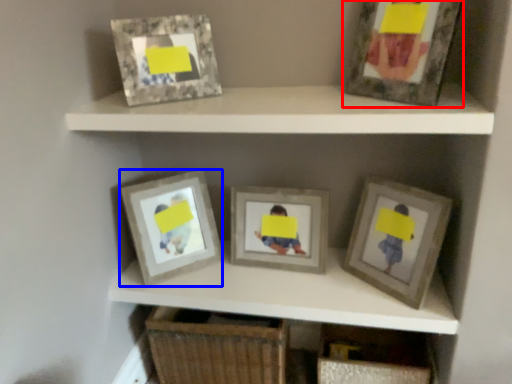
Question: Which object is closer to the camera taking this photo, picture frame (highlighted by a red box) or picture frame (highlighted by a blue box)?

Choices:
 (A) picture frame
 (B) picture frame

Answer: (A)